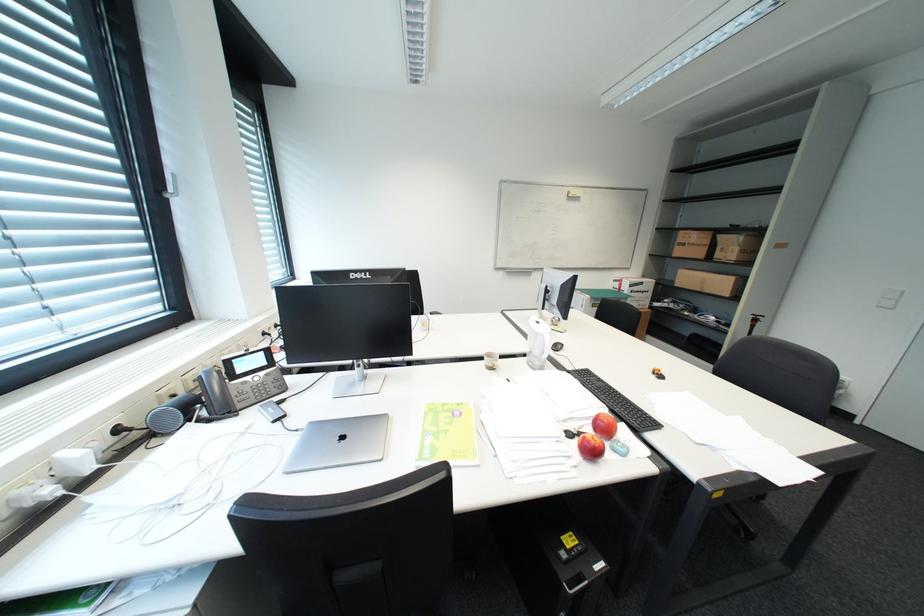
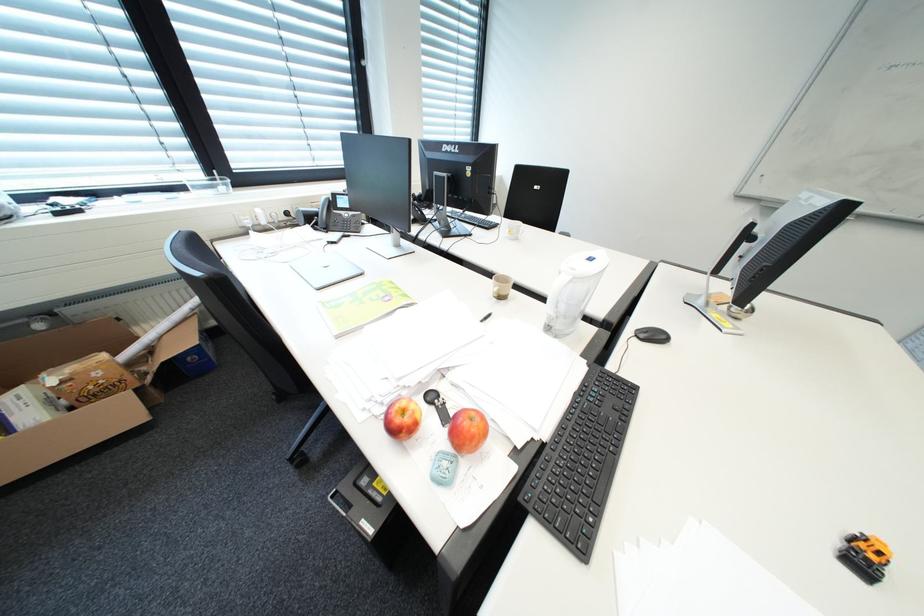
The first image is from the beginning of the video and the second image is from the end. How did the camera likely rotate when shooting the video?

The camera's rotation is toward left-down.